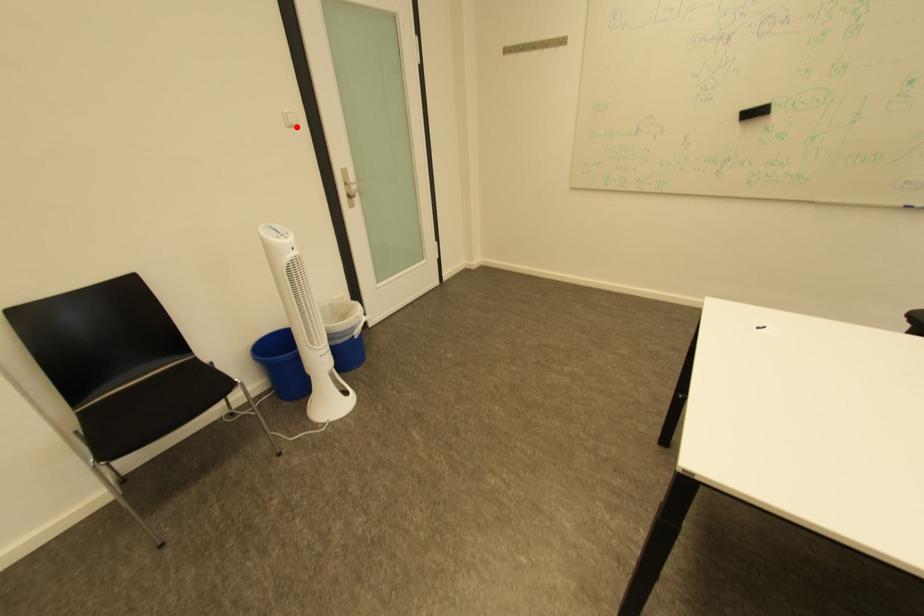
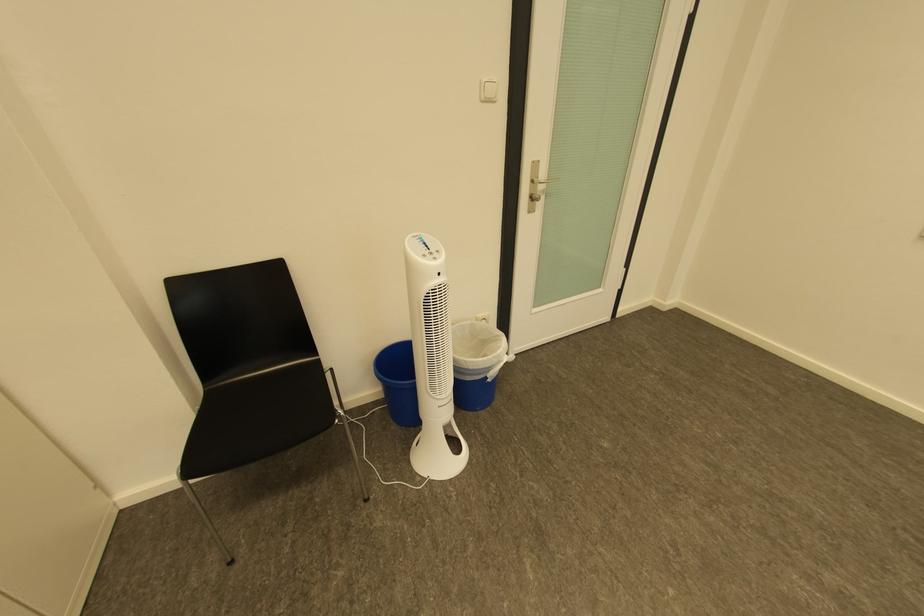
Locate, in the second image, the point that corresponds to the highlighted location in the first image.

(492, 99)